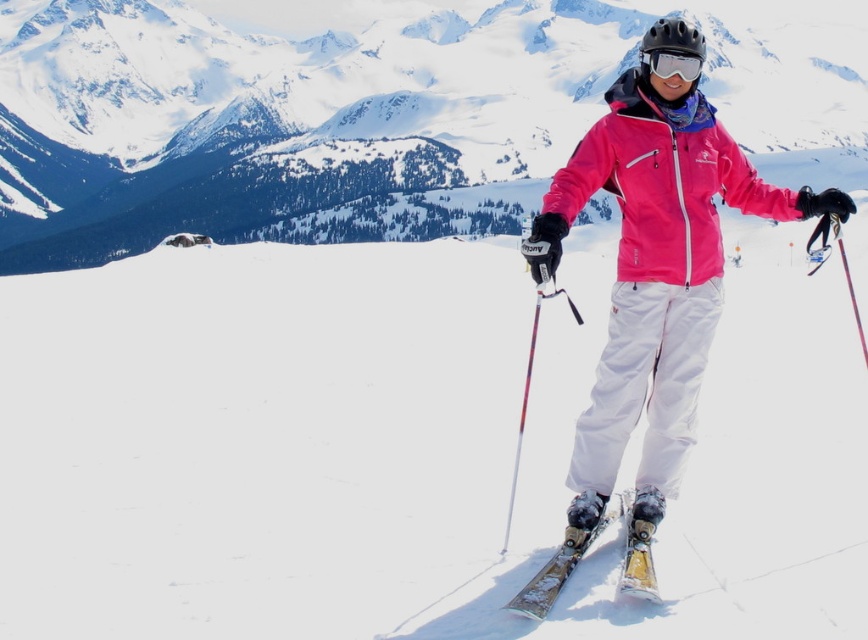
Can you confirm if snowy mountain at center is taller than metallic gold ski at lower center?

Indeed, snowy mountain at center has a greater height compared to metallic gold ski at lower center.

Is point (126, 26) farther from camera compared to point (659, 492)?

Yes.

Which is in front, point (104, 83) or point (651, 580)?

Point (651, 580) is in front.

The height and width of the screenshot is (640, 868). In order to click on snowy mountain at center in this screenshot , I will do `click(281, 120)`.

Can you confirm if metallic gold ski at lower center is bigger than transparent plastic goggles at center?

Indeed, metallic gold ski at lower center has a larger size compared to transparent plastic goggles at center.

From the picture: Who is higher up, metallic gold ski at lower center or transparent plastic goggles at center?

transparent plastic goggles at center is higher up.

Measure the distance between point (640,499) and camera.

Point (640,499) and camera are 261.65 feet apart from each other.

In order to click on metallic gold ski at lower center in this screenshot , I will do tap(641, 545).

Can you confirm if pink matte jacket at center is shorter than metallic gold ski at lower center?

Incorrect, pink matte jacket at center's height does not fall short of metallic gold ski at lower center's.

Does point (694, 49) come farther from viewer compared to point (648, 540)?

Yes, it is.

The height and width of the screenshot is (640, 868). Describe the element at coordinates (654, 269) in the screenshot. I see `pink matte jacket at center` at that location.

This screenshot has height=640, width=868. I want to click on pink matte jacket at center, so click(x=654, y=269).